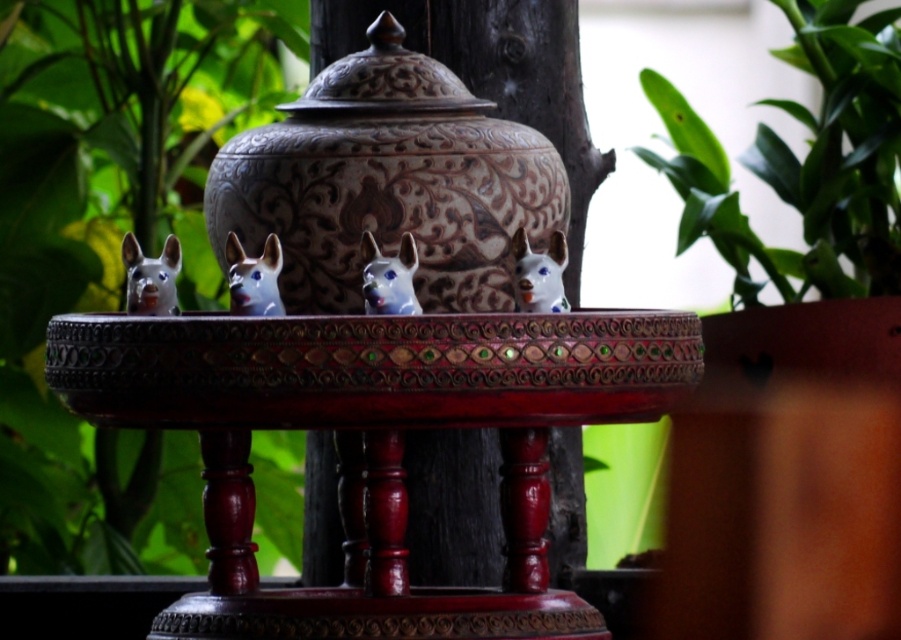
Which is in front, point (875, 13) or point (232, 296)?

Point (232, 296) is in front.

Which is more to the right, green leafy plant at upper right or blue glossy dog head at center?

From the viewer's perspective, green leafy plant at upper right appears more on the right side.

Where is `green leafy plant at upper right`? green leafy plant at upper right is located at coordinates (803, 161).

Is point (376, 273) more distant than point (525, 241)?

No, it is in front of (525, 241).

Is point (406, 289) positioned before point (526, 250)?

That is True.

The height and width of the screenshot is (640, 901). I want to click on porcelain dog at center, so click(389, 276).

Is blue glossy dog head at center wider than white glossy dog head at center?

Indeed, blue glossy dog head at center has a greater width compared to white glossy dog head at center.

Can you confirm if blue glossy dog head at center is positioned below white glossy dog head at center?

Actually, blue glossy dog head at center is above white glossy dog head at center.

Where is `blue glossy dog head at center`? This screenshot has width=901, height=640. blue glossy dog head at center is located at coordinates (253, 276).